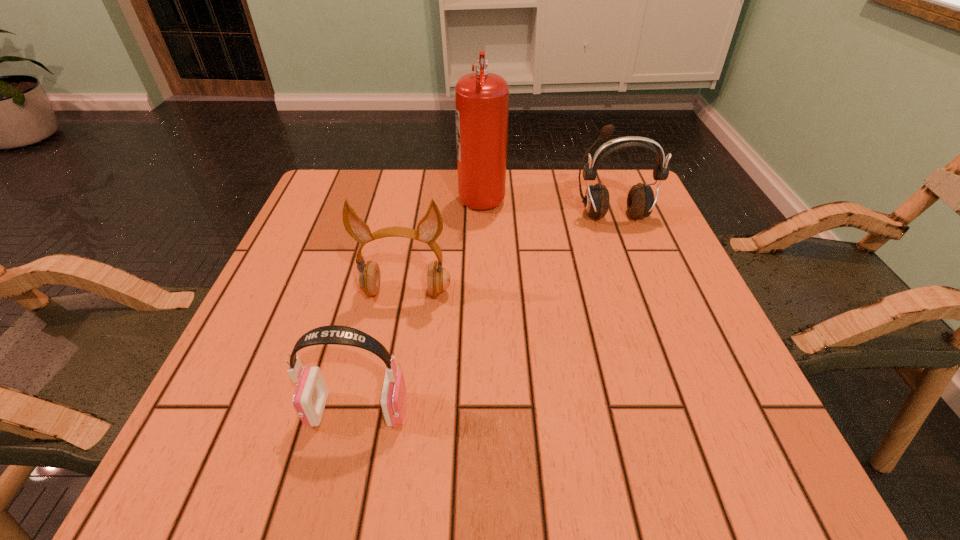
Locate an element on the screen. the third object from left to right is located at coordinates (481, 99).

This screenshot has width=960, height=540. I want to click on fire extinguisher, so click(x=481, y=99).

The image size is (960, 540). What are the coordinates of `the rightmost earphone` in the screenshot? It's located at (640, 201).

You are a GUI agent. You are given a task and a screenshot of the screen. Output one action in this format:
    pyautogui.click(x=<x>, y=<y>)
    Task: Click on the rightmost object
    The width and height of the screenshot is (960, 540).
    Given the screenshot: What is the action you would take?
    pyautogui.click(x=640, y=201)

You are a GUI agent. You are given a task and a screenshot of the screen. Output one action in this format:
    pyautogui.click(x=<x>, y=<y>)
    Task: Click on the third farthest object
    
    Given the screenshot: What is the action you would take?
    367,279

Find the location of `the shortest earphone`. the shortest earphone is located at coordinates (311, 393).

The height and width of the screenshot is (540, 960). Find the location of `the nearest object`. the nearest object is located at coordinates (311, 393).

Locate an element on the screen. The height and width of the screenshot is (540, 960). vacant area located 0.140m on the instruction side of the fire extinguisher is located at coordinates (405, 194).

Where is `free space located on the instruction side of the fire extinguisher`? The width and height of the screenshot is (960, 540). free space located on the instruction side of the fire extinguisher is located at coordinates (394, 194).

Where is `vacant space located 0.250m on the instruction side of the fire extinguisher`? Image resolution: width=960 pixels, height=540 pixels. vacant space located 0.250m on the instruction side of the fire extinguisher is located at coordinates (363, 194).